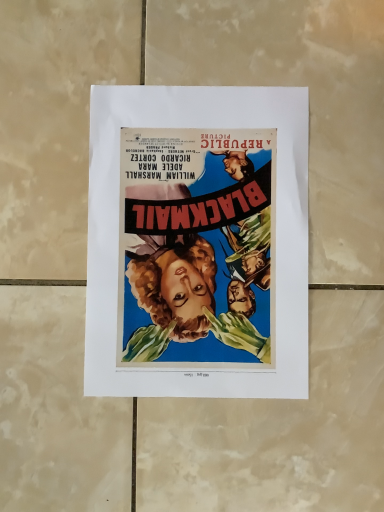
Where is `free space above vibrant paper poster at center (from a real-world perspective)`? This screenshot has width=384, height=512. free space above vibrant paper poster at center (from a real-world perspective) is located at coordinates (199, 239).